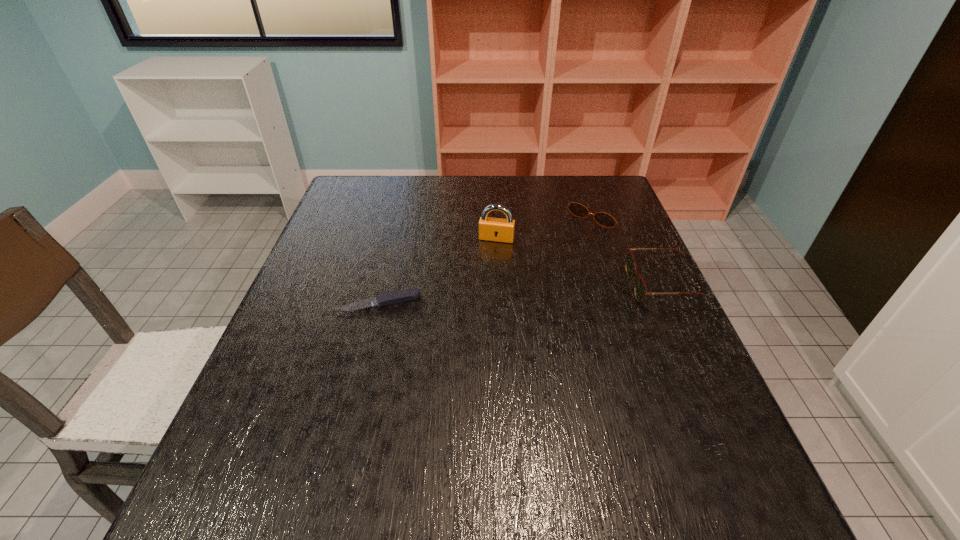
Where is `free space on the desktop that is between the leftmost object and the spectacles and is positioned on the face of the sunglasses`? free space on the desktop that is between the leftmost object and the spectacles and is positioned on the face of the sunglasses is located at coordinates (514, 295).

Find the location of `free space on the desktop that is between the shortest object and the second tallest object and is positioned to unlock the tallest object from the front`. free space on the desktop that is between the shortest object and the second tallest object and is positioned to unlock the tallest object from the front is located at coordinates (481, 297).